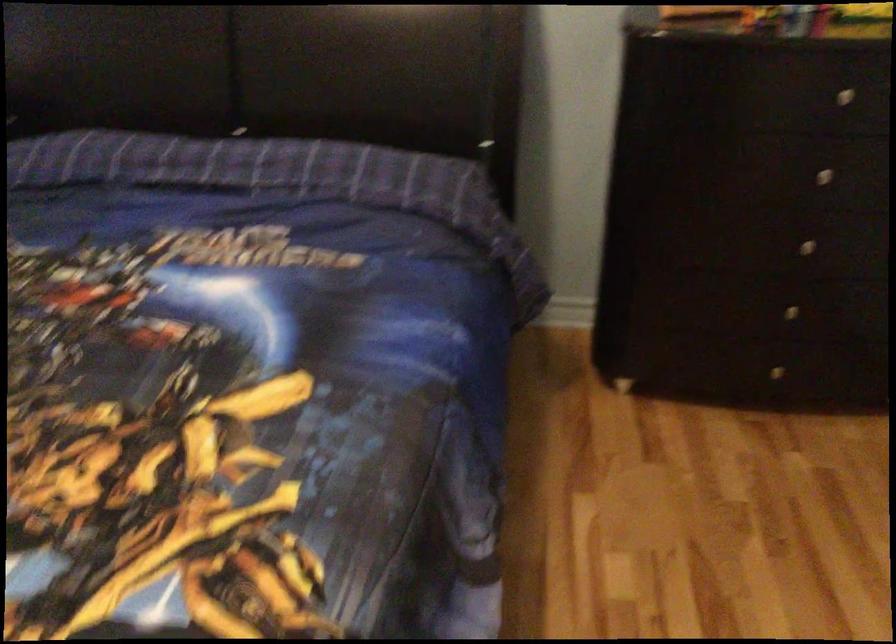
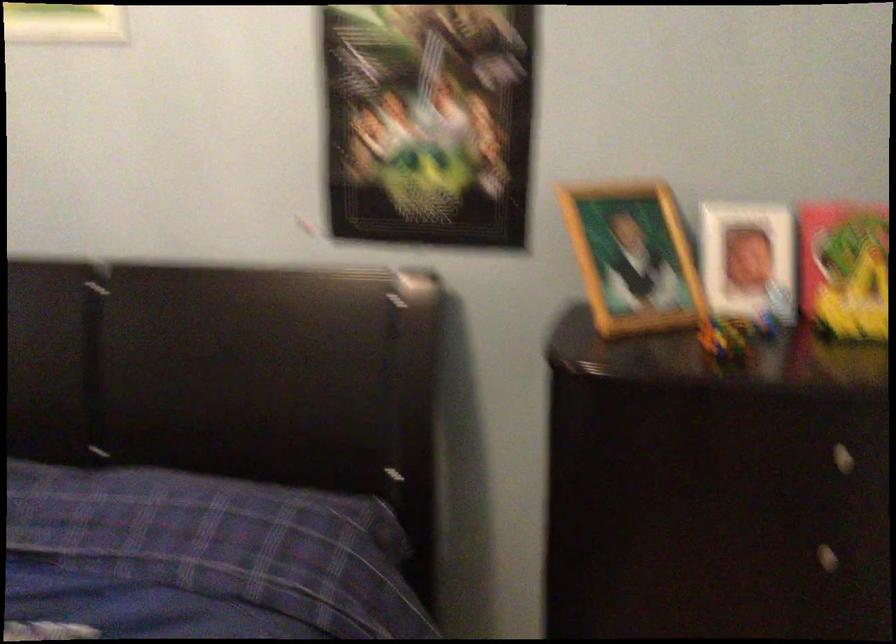
Question: Based on the continuous images, in which direction is the camera rotating? Reply with the corresponding letter.

Choices:
 (A) Left
 (B) Right
 (C) Up
 (D) Down

Answer: (C)